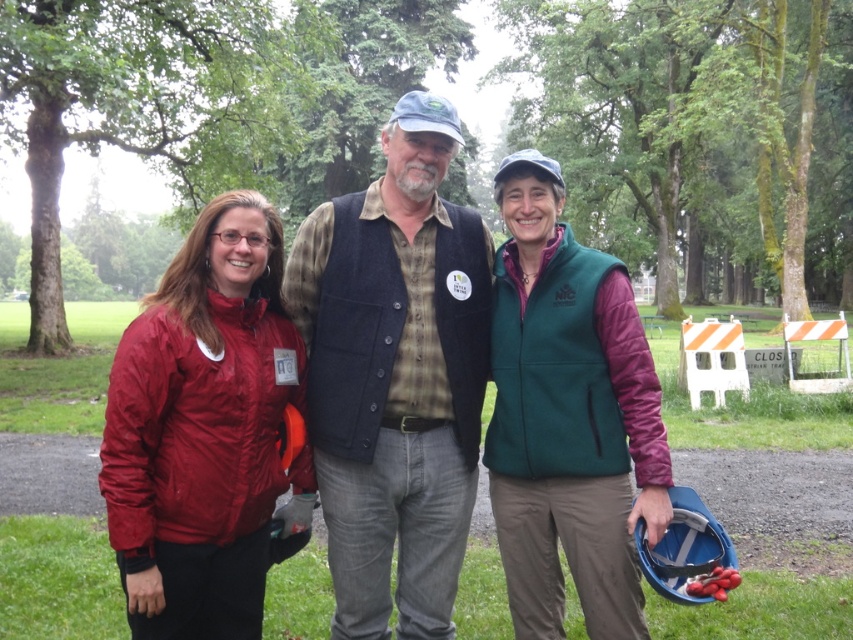
Question: Which object appears farthest from the camera in this image?

Choices:
 (A) matte red jacket at left
 (B) green fleece vest at center

Answer: (B)

Question: Which object is farther from the camera taking this photo?

Choices:
 (A) denim vest at center
 (B) green fleece vest at center
 (C) matte red jacket at center
 (D) matte red jacket at left

Answer: (A)

Question: Is the position of denim vest at center less distant than that of green fleece vest at center?

Choices:
 (A) no
 (B) yes

Answer: (A)

Question: Is the position of matte red jacket at left more distant than that of matte red jacket at center?

Choices:
 (A) yes
 (B) no

Answer: (A)

Question: Considering the real-world distances, which object is closest to the matte red jacket at left?

Choices:
 (A) matte red jacket at center
 (B) green fleece vest at center

Answer: (A)

Question: Is matte red jacket at left behind green fleece vest at center?

Choices:
 (A) no
 (B) yes

Answer: (A)